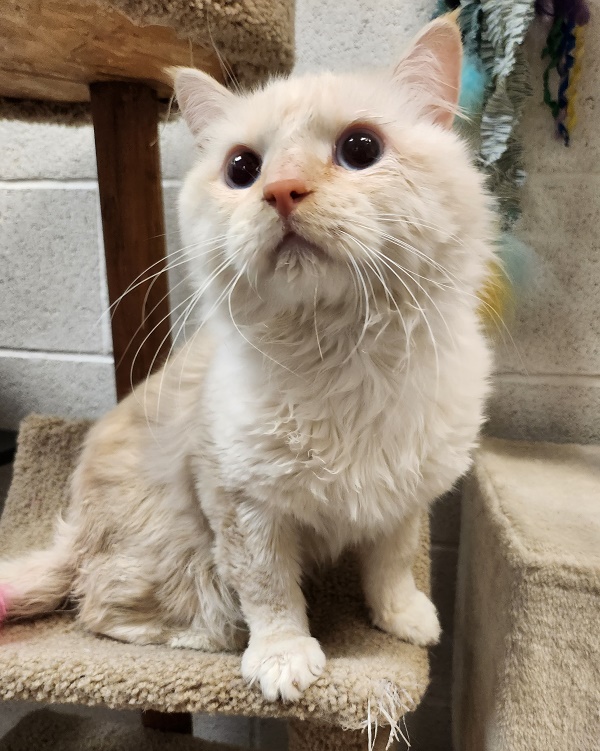
The image size is (600, 751). In order to click on carpeting in this screenshot , I will do `click(272, 14)`, `click(523, 665)`, `click(388, 676)`, `click(143, 740)`.